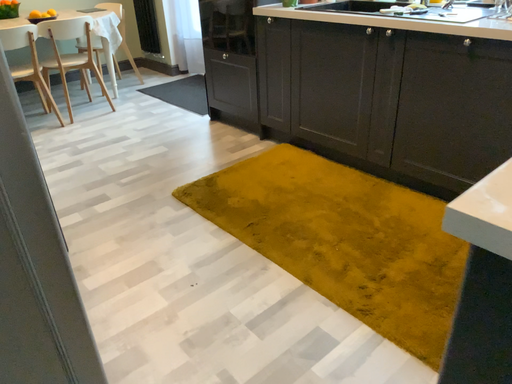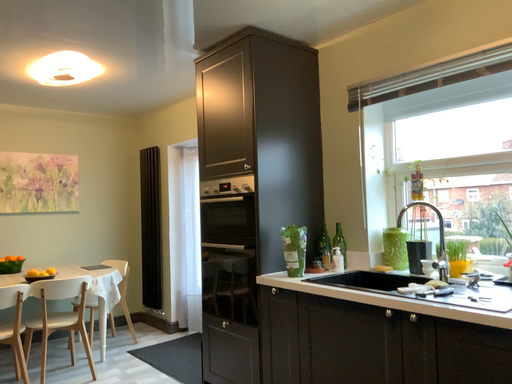
Question: Which way did the camera rotate in the video?

Choices:
 (A) rotated downward
 (B) rotated upward

Answer: (B)